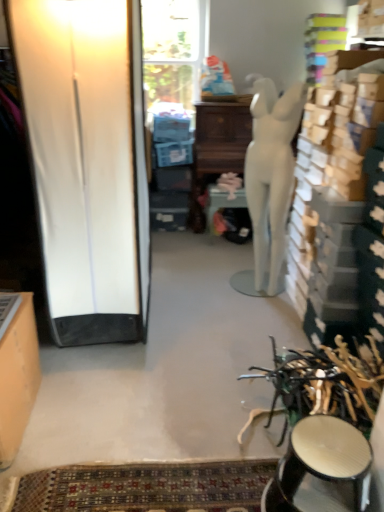
What are the coordinates of `white matte mannequin at center` in the screenshot? It's located at (271, 173).

What do you see at coordinates (271, 173) in the screenshot?
I see `white matte mannequin at center` at bounding box center [271, 173].

Describe the element at coordinates (87, 162) in the screenshot. The width and height of the screenshot is (384, 512). I see `white glossy screen door at left` at that location.

This screenshot has width=384, height=512. In order to click on white glossy screen door at left in this screenshot , I will do `click(87, 162)`.

What do you see at coordinates (321, 462) in the screenshot?
I see `shiny metallic stool at lower right` at bounding box center [321, 462].

What do you see at coordinates (146, 487) in the screenshot? I see `patterned carpet at lower center` at bounding box center [146, 487].

Find the location of a particular element. The width and height of the screenshot is (384, 512). white matte mannequin at center is located at coordinates (271, 173).

This screenshot has height=512, width=384. I want to click on person positioned vertically above the shiny metallic stool at lower right (from a real-world perspective), so click(271, 173).

Can you confirm if white matte mannequin at center is wider than shiny metallic stool at lower right?

Incorrect, the width of white matte mannequin at center does not surpass that of shiny metallic stool at lower right.

From the image's perspective, is white matte mannequin at center above or below shiny metallic stool at lower right?

white matte mannequin at center is above shiny metallic stool at lower right.

Is matte orange cabinet at left directly adjacent to shiny metallic stool at lower right?

No, matte orange cabinet at left is not in contact with shiny metallic stool at lower right.

From the image's perspective, which is above, matte orange cabinet at left or shiny metallic stool at lower right?

matte orange cabinet at left appears higher in the image.

How different are the orientations of matte orange cabinet at left and shiny metallic stool at lower right in degrees?

The angular difference between matte orange cabinet at left and shiny metallic stool at lower right is 179 degrees.

From a real-world perspective, is matte orange cabinet at left over shiny metallic stool at lower right?

Indeed, from a real-world perspective, matte orange cabinet at left stands above shiny metallic stool at lower right.

From the image's perspective, which is above, white glossy screen door at left or patterned carpet at lower center?

white glossy screen door at left is shown above in the image.

Considering the sizes of objects white glossy screen door at left and patterned carpet at lower center in the image provided, who is wider, white glossy screen door at left or patterned carpet at lower center?

white glossy screen door at left is wider.

Between white glossy screen door at left and patterned carpet at lower center, which one has larger size?

white glossy screen door at left.

Considering the sizes of objects white glossy screen door at left and patterned carpet at lower center in the image provided, who is shorter, white glossy screen door at left or patterned carpet at lower center?

patterned carpet at lower center is shorter.

Considering the sizes of shiny metallic stool at lower right and patterned carpet at lower center in the image, is shiny metallic stool at lower right bigger or smaller than patterned carpet at lower center?

Considering their sizes, shiny metallic stool at lower right takes up more space than patterned carpet at lower center.

Considering the sizes of shiny metallic stool at lower right and patterned carpet at lower center in the image, is shiny metallic stool at lower right taller or shorter than patterned carpet at lower center?

Considering their sizes, shiny metallic stool at lower right has more height than patterned carpet at lower center.

Can you confirm if shiny metallic stool at lower right is positioned to the right of patterned carpet at lower center?

Correct, you'll find shiny metallic stool at lower right to the right of patterned carpet at lower center.

Is point (333, 506) positioned before point (186, 502)?

Yes, point (333, 506) is in front of point (186, 502).

Is white matte mannequin at center at the back of patterned carpet at lower center?

patterned carpet at lower center is not turned away from white matte mannequin at center.

Is patterned carpet at lower center not within white matte mannequin at center?

Absolutely, patterned carpet at lower center is external to white matte mannequin at center.

Which of these two, patterned carpet at lower center or white matte mannequin at center, is thinner?

Thinner between the two is patterned carpet at lower center.

From a real-world perspective, which is physically below, patterned carpet at lower center or white matte mannequin at center?

In real-world perspective, patterned carpet at lower center is lower.

Which is behind, matte orange cabinet at left or white matte mannequin at center?

white matte mannequin at center is more distant.

Does matte orange cabinet at left have a greater width compared to white matte mannequin at center?

No.

Identify the location of cabinetry on the left of the white matte mannequin at center. (17, 370).

How far apart are matte orange cabinet at left and white matte mannequin at center?

matte orange cabinet at left and white matte mannequin at center are 5.57 feet apart from each other.

Which object is more forward, white matte mannequin at center or patterned carpet at lower center?

patterned carpet at lower center is closer to the camera.

From the image's perspective, would you say white matte mannequin at center is shown under patterned carpet at lower center?

No, from the image's perspective, white matte mannequin at center is not beneath patterned carpet at lower center.

Is white matte mannequin at center completely or partially outside of patterned carpet at lower center?

white matte mannequin at center lies outside patterned carpet at lower center's area.

Locate an element on the screen. person above the shiny metallic stool at lower right (from a real-world perspective) is located at coordinates 271,173.

You are a GUI agent. You are given a task and a screenshot of the screen. Output one action in this format:
    pyautogui.click(x=<x>, y=<y>)
    Task: Click on the stool below the matte orange cabinet at left (from the image's perspective)
    This screenshot has width=384, height=512.
    Given the screenshot: What is the action you would take?
    pyautogui.click(x=321, y=462)

Based on their spatial positions, is shiny metallic stool at lower right or white glossy screen door at left further from patterned carpet at lower center?

white glossy screen door at left lies further to patterned carpet at lower center than the other object.

When comparing their distances from white matte mannequin at center, does white glossy screen door at left or matte orange cabinet at left seem closer?

white glossy screen door at left.

Which object lies further to the anchor point matte orange cabinet at left, patterned carpet at lower center or white glossy screen door at left?

white glossy screen door at left is positioned further to the anchor matte orange cabinet at left.

Which object lies further to the anchor point matte orange cabinet at left, shiny metallic stool at lower right or white matte mannequin at center?

white matte mannequin at center.

Considering their positions, is white glossy screen door at left positioned closer to matte orange cabinet at left than patterned carpet at lower center?

The object closer to matte orange cabinet at left is patterned carpet at lower center.

Considering their positions, is matte orange cabinet at left positioned closer to patterned carpet at lower center than white matte mannequin at center?

matte orange cabinet at left lies closer to patterned carpet at lower center than the other object.

When comparing their distances from shiny metallic stool at lower right, does white matte mannequin at center or white glossy screen door at left seem further?

Based on the image, white matte mannequin at center appears to be further to shiny metallic stool at lower right.

Looking at the image, which one is located further to white matte mannequin at center, patterned carpet at lower center or white glossy screen door at left?

patterned carpet at lower center is further to white matte mannequin at center.

Where is `stool between matte orange cabinet at left and white matte mannequin at center`? The image size is (384, 512). stool between matte orange cabinet at left and white matte mannequin at center is located at coordinates (321, 462).

The width and height of the screenshot is (384, 512). In order to click on mat between matte orange cabinet at left and white matte mannequin at center in the horizontal direction in this screenshot , I will do `click(146, 487)`.

I want to click on screen door between matte orange cabinet at left and white matte mannequin at center, so click(x=87, y=162).

Find the location of `stool between white glossy screen door at left and patterned carpet at lower center in the up-down direction`. stool between white glossy screen door at left and patterned carpet at lower center in the up-down direction is located at coordinates (321, 462).